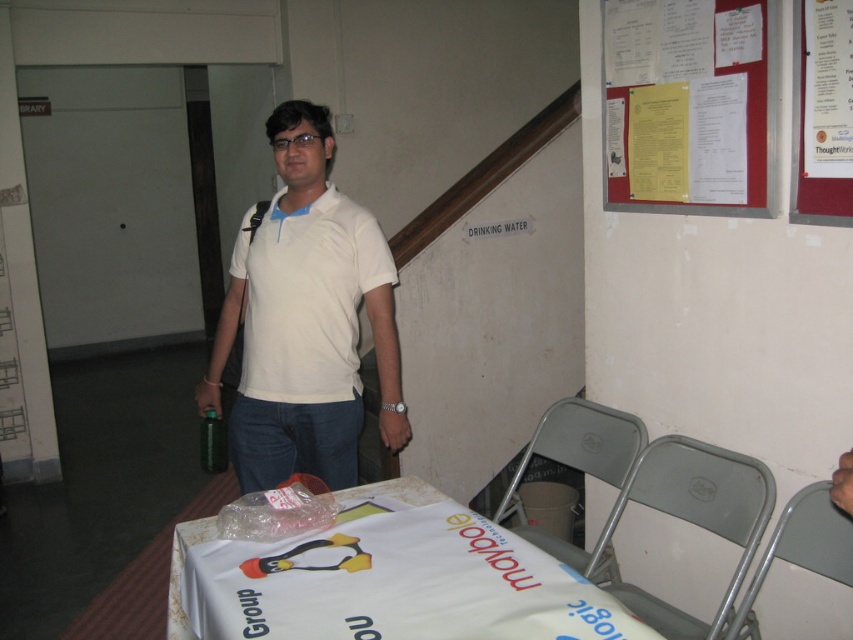
Question: From the image, what is the correct spatial relationship of white paper table at lower center in relation to white matte polo shirt at center?

Choices:
 (A) right
 (B) left

Answer: (A)

Question: Which point is closer to the camera?

Choices:
 (A) green matte bottle at center
 (B) white matte polo shirt at center

Answer: (B)

Question: Which of these objects is positioned farthest from the white matte shirt at center?

Choices:
 (A) red paperboard at upper right
 (B) yellow paper at upper right
 (C) white matte polo shirt at center
 (D) white paper table at lower center

Answer: (A)

Question: Among these points, which one is nearest to the camera?

Choices:
 (A) (848, 49)
 (B) (724, 77)
 (C) (215, 460)

Answer: (A)

Question: Is white paper table at lower center below white matte polo shirt at center?

Choices:
 (A) yes
 (B) no

Answer: (A)

Question: Is white matte shirt at center thinner than white matte polo shirt at center?

Choices:
 (A) no
 (B) yes

Answer: (A)